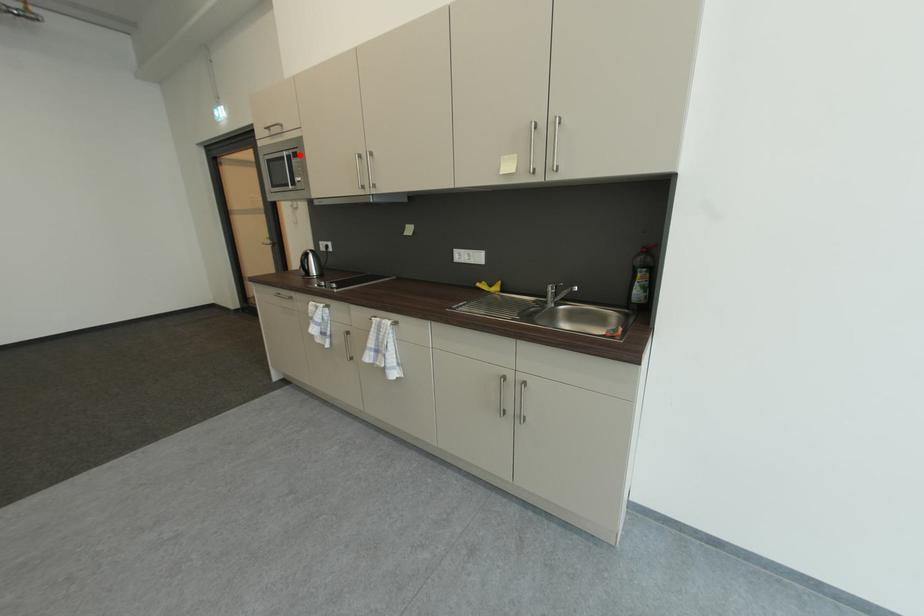
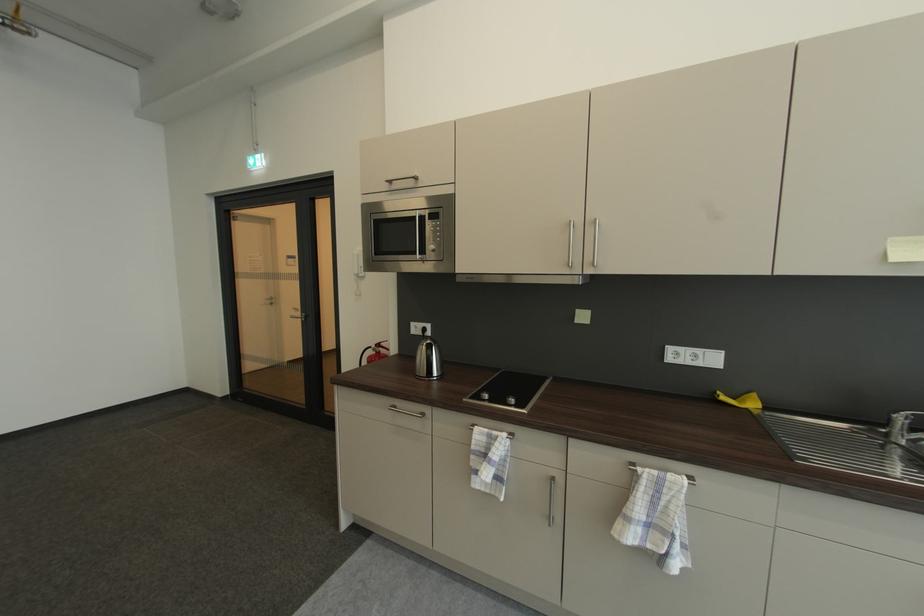
In the second image, find the point that corresponds to the highlighted location in the first image.

(436, 215)